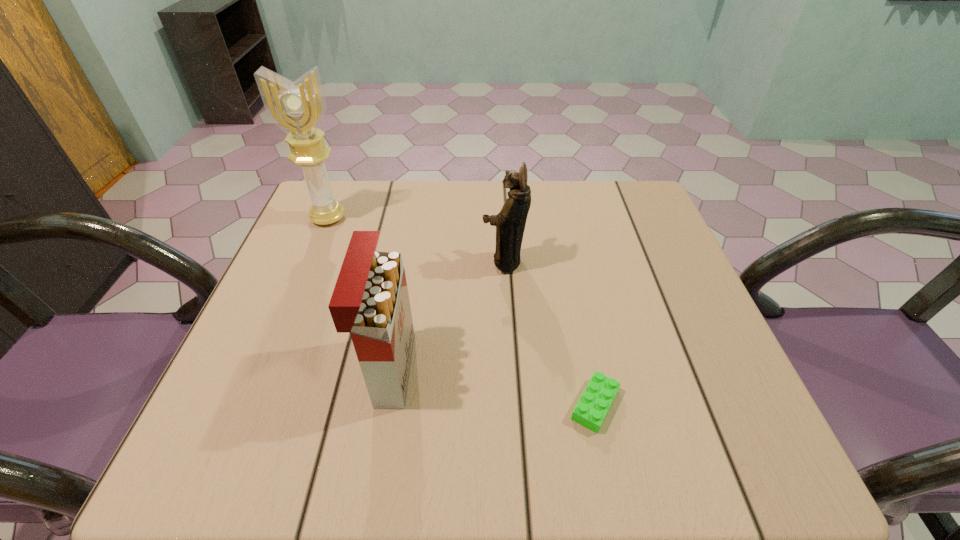
Image resolution: width=960 pixels, height=540 pixels. In order to click on the farthest object in this screenshot , I will do `click(298, 108)`.

Where is `the leftmost object`? This screenshot has width=960, height=540. the leftmost object is located at coordinates (298, 108).

This screenshot has height=540, width=960. Find the location of `the third object from right to left`. the third object from right to left is located at coordinates (370, 300).

Locate an element on the screen. The image size is (960, 540). the third nearest object is located at coordinates (510, 222).

Find the location of `figurine`. figurine is located at coordinates (510, 222).

Identify the location of the rightmost object. (596, 400).

Find the location of a particular element. Lego is located at coordinates (596, 400).

You are a GUI agent. You are given a task and a screenshot of the screen. Output one action in this format:
    pyautogui.click(x=<x>, y=<y>)
    Task: Click on the vacant space located on the front-facing side of the farthest object
    The width and height of the screenshot is (960, 540).
    Given the screenshot: What is the action you would take?
    pyautogui.click(x=315, y=249)

The height and width of the screenshot is (540, 960). In order to click on blank area located 0.330m with the lid open on the second object from left to right in this screenshot , I will do `click(589, 369)`.

This screenshot has height=540, width=960. Identify the location of vacant space situated 0.340m on the front-facing side of the figurine. (336, 261).